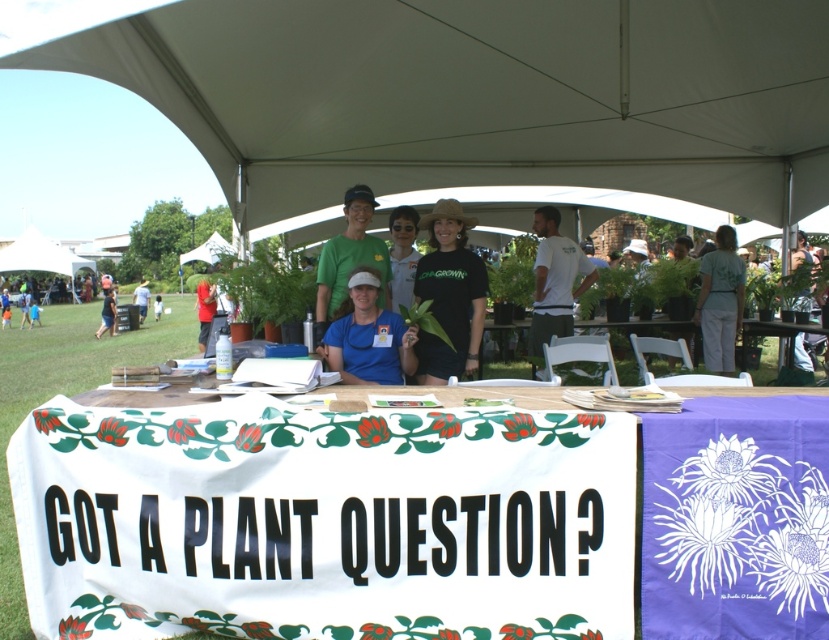
Question: Can you confirm if blue t-shirt at center is bigger than blue fabric sign at center?

Choices:
 (A) yes
 (B) no

Answer: (A)

Question: Considering the real-world distances, which object is closest to the blue fabric sign at center?

Choices:
 (A) white cotton shirt at center
 (B) black matte t-shirt at center
 (C) blue t-shirt at center

Answer: (C)

Question: Is black matte t-shirt at center positioned at the back of blue fabric shirt at center?

Choices:
 (A) yes
 (B) no

Answer: (A)

Question: Which of the following is the closest to the observer?

Choices:
 (A) white cotton shirt at center
 (B) white fabric at center

Answer: (B)

Question: Is blue t-shirt at center further to camera compared to light blue shirt at center?

Choices:
 (A) no
 (B) yes

Answer: (A)

Question: Which is farther from the matte green shirt at center?

Choices:
 (A) wooden picnic table at center
 (B) black matte t-shirt at center
 (C) white cotton shirt at center

Answer: (A)